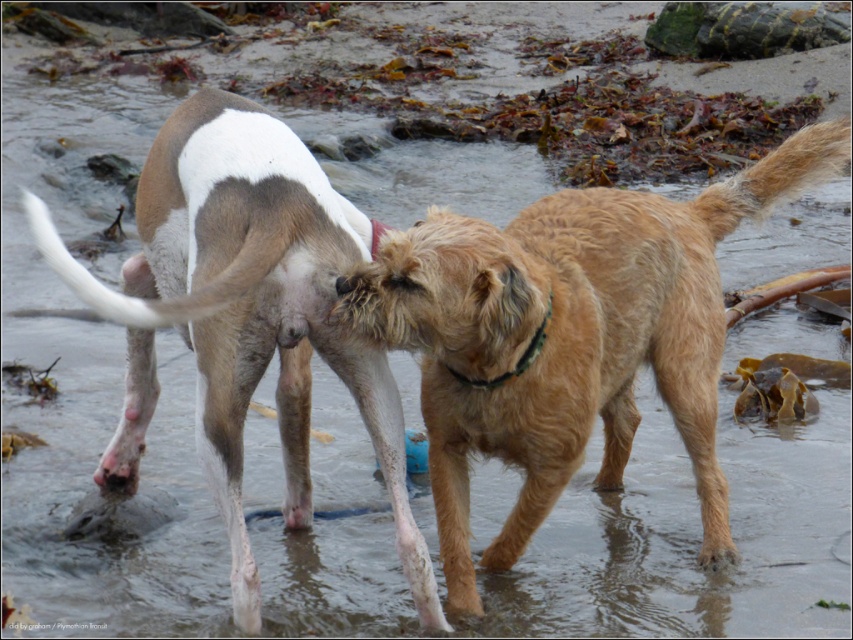
You are a photographer trying to capture a photo of both the golden fur dog at center and the brown fur dog at center. Since you want them to appear side by side in the photo, which dog should you position to the right to achieve this?

The golden fur dog at center is already positioned on the right side of brown fur dog at center, so you should keep the golden fur dog at center on the right to have them side by side.

You are standing at the edge of the beach and want to walk towards the two points marked in the image. Which point, point (383,326) or point (172,211), will you reach first?

Point (383,326) is closer to the viewer than point (172,211), so you will reach point (383,326) first.

You are a drone operator trying to capture a photo of two dogs playing in shallow water. The dogs are located at point (556, 464). If your drone can only focus on objects within a 10 feet radius, will it be able to capture both dogs in focus?

The dogs are 10.58 feet apart, which is beyond the 10 feet radius of the drone, so it cannot capture both dogs in focus.